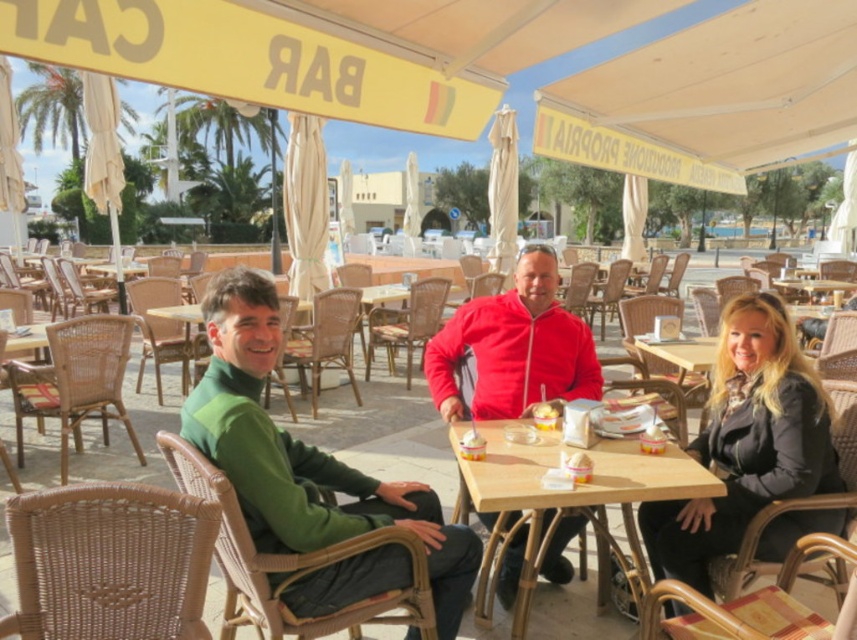
Can you confirm if green woven sweater at center is positioned below wooden table at center?

No.

Does point (258, 504) come behind point (495, 481)?

That is False.

Which is behind, point (405, 508) or point (598, 605)?

The point (598, 605) is more distant.

Where is `green woven sweater at center`? green woven sweater at center is located at coordinates (303, 456).

Does black leather jacket at lower right have a smaller size compared to wooden table at center?

Actually, black leather jacket at lower right might be larger than wooden table at center.

Image resolution: width=857 pixels, height=640 pixels. Describe the element at coordinates (746, 442) in the screenshot. I see `black leather jacket at lower right` at that location.

Which is behind, point (670, 504) or point (561, 502)?

The point (670, 504) is more distant.

The image size is (857, 640). I want to click on black leather jacket at lower right, so click(746, 442).

Does black leather jacket at lower right lie in front of velvet red jacket at center?

Yes, black leather jacket at lower right is in front of velvet red jacket at center.

Between black leather jacket at lower right and velvet red jacket at center, which one appears on the right side from the viewer's perspective?

black leather jacket at lower right is more to the right.

Between point (741, 515) and point (525, 278), which one is positioned in front?

Point (741, 515) is more forward.

Locate an element on the screen. black leather jacket at lower right is located at coordinates (746, 442).